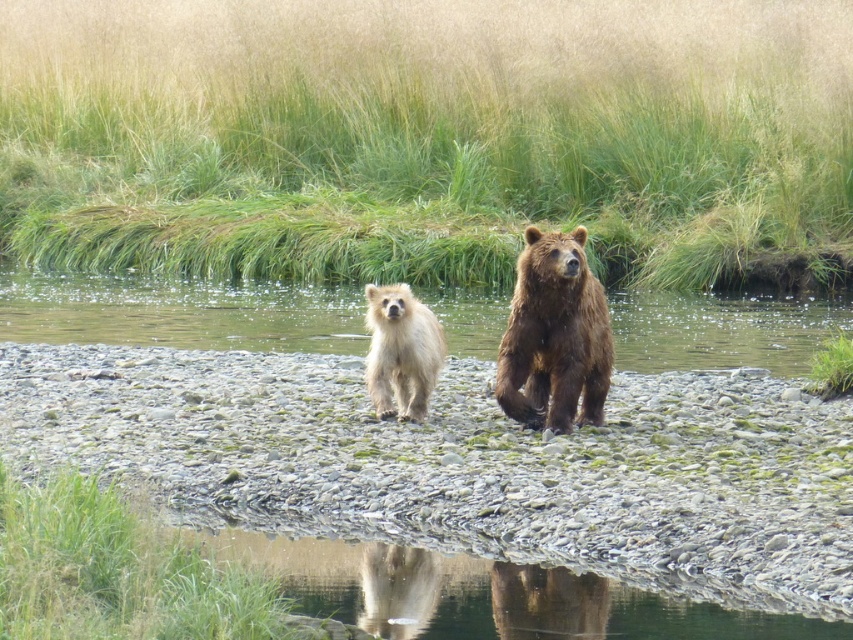
Question: Does brown fur river at center have a smaller size compared to fuzzy fur bear at center?

Choices:
 (A) yes
 (B) no

Answer: (B)

Question: Is green mossy rocks at center smaller than brown fur river at center?

Choices:
 (A) no
 (B) yes

Answer: (B)

Question: Based on their relative distances, which object is farther from the brown furry bear at center?

Choices:
 (A) brown fur river at center
 (B) green mossy rocks at center

Answer: (A)

Question: Is green mossy rocks at center wider than brown fur river at center?

Choices:
 (A) yes
 (B) no

Answer: (B)

Question: Which of the following is the farthest from the observer?

Choices:
 (A) (793, 422)
 (B) (380, 291)
 (C) (526, 356)

Answer: (A)

Question: Which point is farther to the camera?

Choices:
 (A) (271, 346)
 (B) (677, 509)
 (C) (548, 422)
 (D) (386, 390)

Answer: (A)